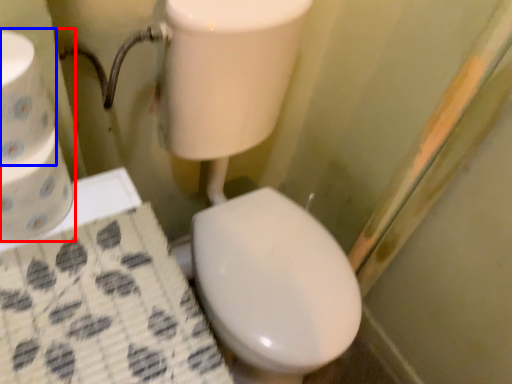
Question: Which object appears closest to the camera in this image, toilet paper (highlighted by a red box) or toilet paper (highlighted by a blue box)?

Choices:
 (A) toilet paper
 (B) toilet paper

Answer: (B)